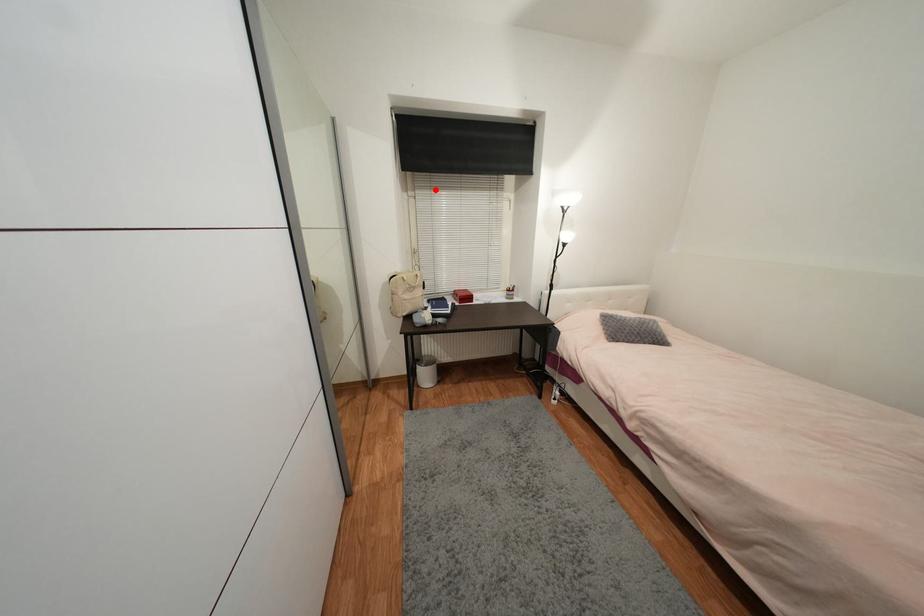
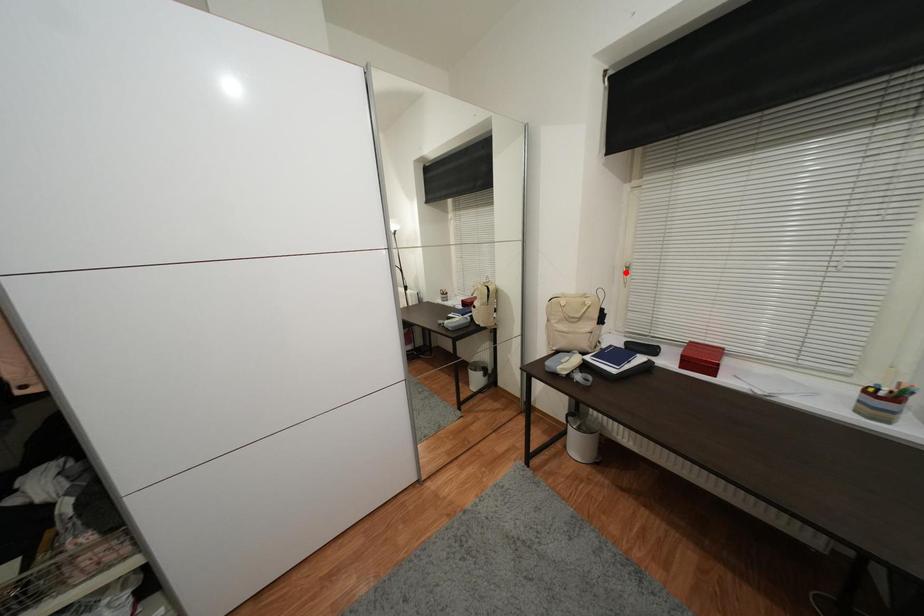
I am providing you with two images of the same scene from different viewpoints. A red point is marked on the first image and another point is marked on the second image. Do the highlighted points in image1 and image2 indicate the same real-world spot?

No